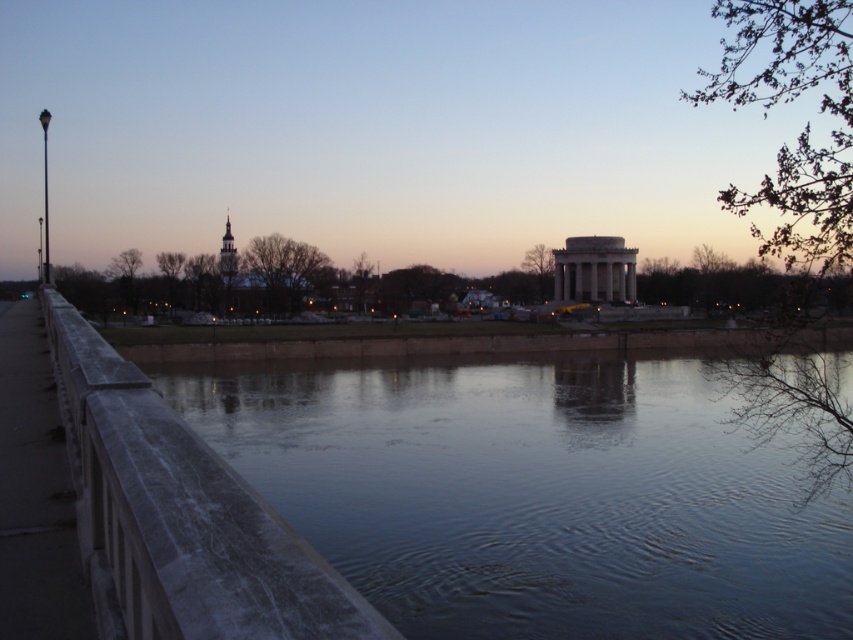
Question: Among these points, which one is farthest from the camera?

Choices:
 (A) (103, 500)
 (B) (699, 461)

Answer: (B)

Question: Which of the following is the farthest from the observer?

Choices:
 (A) (44, 294)
 (B) (514, 419)

Answer: (B)

Question: Which of the following is the farthest from the observer?

Choices:
 (A) (67, 384)
 (B) (500, 611)

Answer: (B)

Question: From the image, what is the correct spatial relationship of smooth concrete river at center in relation to smooth concrete railing at left?

Choices:
 (A) above
 (B) below

Answer: (B)

Question: Can you confirm if smooth concrete river at center is smaller than smooth concrete railing at left?

Choices:
 (A) no
 (B) yes

Answer: (A)

Question: In this image, where is smooth concrete river at center located relative to smooth concrete railing at left?

Choices:
 (A) left
 (B) right

Answer: (B)